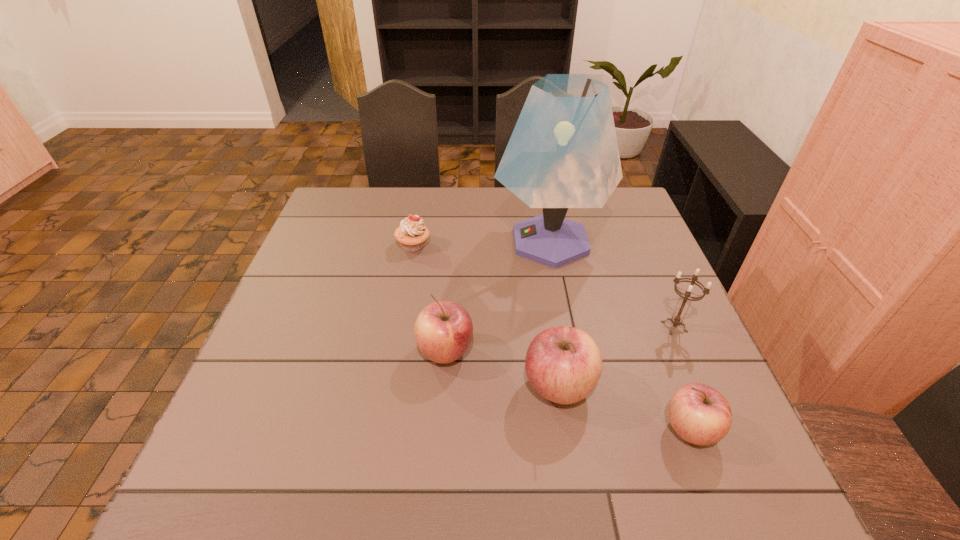
At what (x,y) coordinates should I click in order to perform the action: click on the second shortest apple. Please return your answer as a coordinate pair (x, y). Image resolution: width=960 pixels, height=540 pixels. Looking at the image, I should click on (443, 331).

Locate an element on the screen. The height and width of the screenshot is (540, 960). the fifth object from right to left is located at coordinates point(443,331).

You are a GUI agent. You are given a task and a screenshot of the screen. Output one action in this format:
    pyautogui.click(x=<x>, y=<y>)
    Task: Click on the second apple from left to right
    
    Given the screenshot: What is the action you would take?
    pyautogui.click(x=563, y=364)

Locate an element on the screen. the rightmost apple is located at coordinates (699, 414).

Find the location of a particular element. the tallest object is located at coordinates pos(563,153).

Identify the location of candle holder. The height and width of the screenshot is (540, 960). (676, 320).

Locate an element on the screen. The image size is (960, 540). cupcake is located at coordinates (412, 234).

Find the location of `blank space located 0.330m on the back of the leftmost apple`. blank space located 0.330m on the back of the leftmost apple is located at coordinates (453, 244).

Identify the location of free space located 0.390m on the left of the second apple from left to right. (335, 387).

Where is `free location located on the back of the rightmost apple`? The height and width of the screenshot is (540, 960). free location located on the back of the rightmost apple is located at coordinates (668, 372).